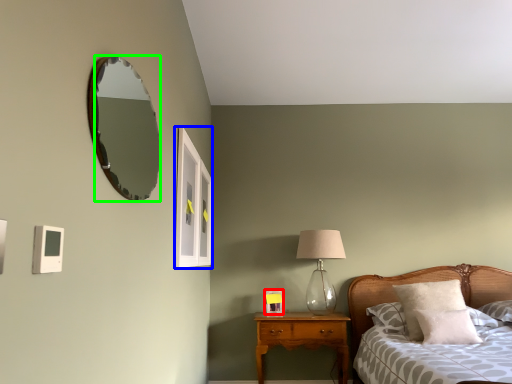
Question: Which is farther away from picture frame (highlighted by a red box)? window (highlighted by a blue box) or mirror (highlighted by a green box)?

Choices:
 (A) window
 (B) mirror

Answer: (B)